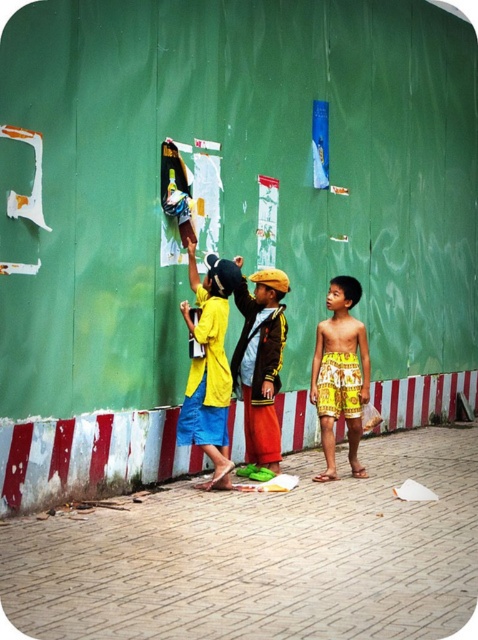
Is yellow matte shirt at center above yellow printed shorts at right?

Yes.

Between point (207, 298) and point (347, 332), which one is positioned in front?

Positioned in front is point (207, 298).

Locate an element on the screen. This screenshot has height=640, width=478. yellow matte shirt at center is located at coordinates (208, 368).

Can you confirm if yellow fabric jacket at center is thinner than yellow printed shorts at right?

Yes.

Is yellow fabric jacket at center positioned in front of yellow printed shorts at right?

Yes.

Find the location of a particular element. This screenshot has height=640, width=478. yellow fabric jacket at center is located at coordinates (260, 364).

Can you confirm if yellow matte shirt at center is positioned above yellow fabric jacket at center?

Indeed, yellow matte shirt at center is positioned over yellow fabric jacket at center.

Find the location of `yellow matte shirt at center`. yellow matte shirt at center is located at coordinates (208, 368).

The width and height of the screenshot is (478, 640). What are the coordinates of `yellow matte shirt at center` in the screenshot? It's located at (208, 368).